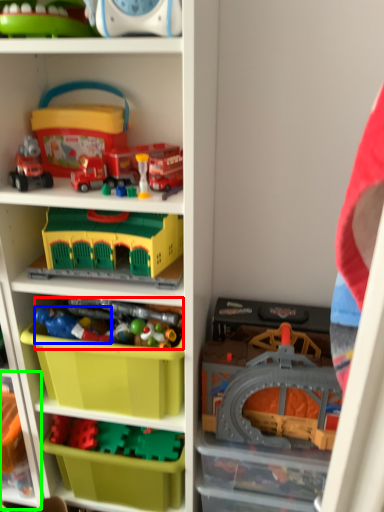
Question: Which is farther away from toy (highlighted by a red box)? toy (highlighted by a blue box) or shelf (highlighted by a green box)?

Choices:
 (A) toy
 (B) shelf

Answer: (B)